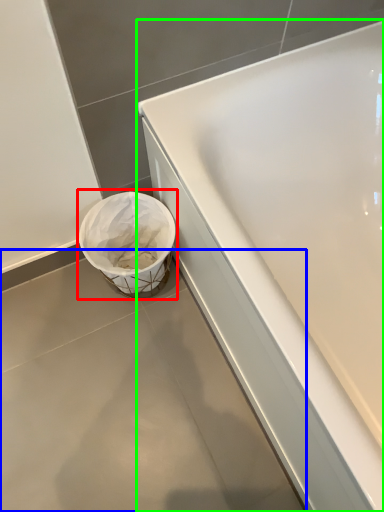
Question: Based on their relative distances, which object is nearer to waste container (highlighted by a red box)? Choose from concrete (highlighted by a blue box) and bathtub (highlighted by a green box).

Choices:
 (A) concrete
 (B) bathtub

Answer: (A)